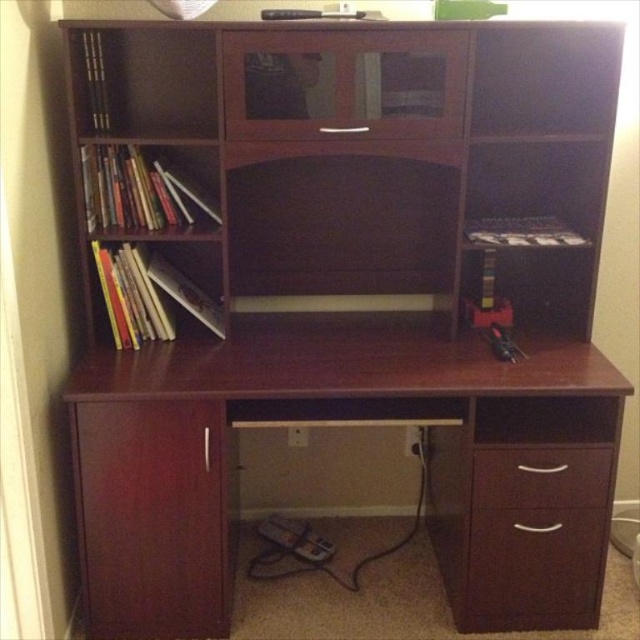
You are trying to locate a specific drawer on the desk setup. The coordinates given are point (x=534, y=568). Based on the scene description, which object corresponds to this coordinate?

The point (x=534, y=568) corresponds to the matte wood drawer at lower right.

You are organizing your desk and need to place a 6.5 inch wide notebook between the matte wood drawer at lower right and the dark wood drawer at lower right. Can you fit it there?

The distance between the matte wood drawer at lower right and the dark wood drawer at lower right is 5.77 inches, which is narrower than the 6.5 inch wide notebook. Therefore, the notebook cannot fit between them.